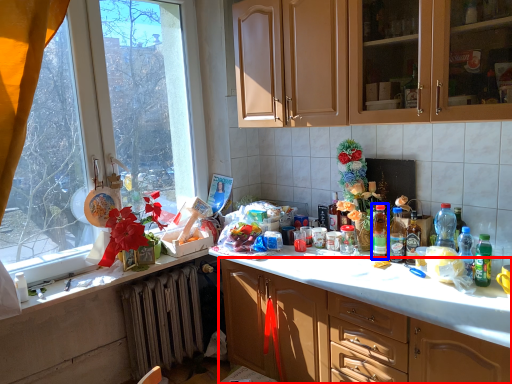
Question: Which point is further to the camera, cabinetry (highlighted by a red box) or bottle (highlighted by a blue box)?

Choices:
 (A) cabinetry
 (B) bottle

Answer: (B)